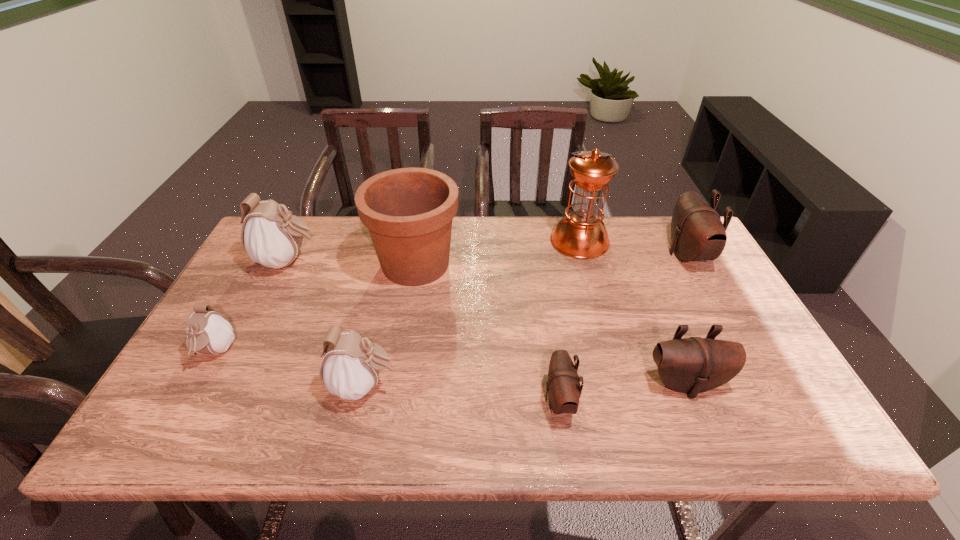
Locate an element on the screen. The image size is (960, 540). vacant space that satisfies the following two spatial constraints: 1. on the front-facing side of the flowerpot; 2. on the left side of the farthest white pouch is located at coordinates (288, 264).

Find the location of a particular element. Image resolution: width=960 pixels, height=540 pixels. vacant position in the image that satisfies the following two spatial constraints: 1. with the flap open on the second brown pouch from left to right; 2. with the flap open on the fifth object from left to right is located at coordinates (692, 400).